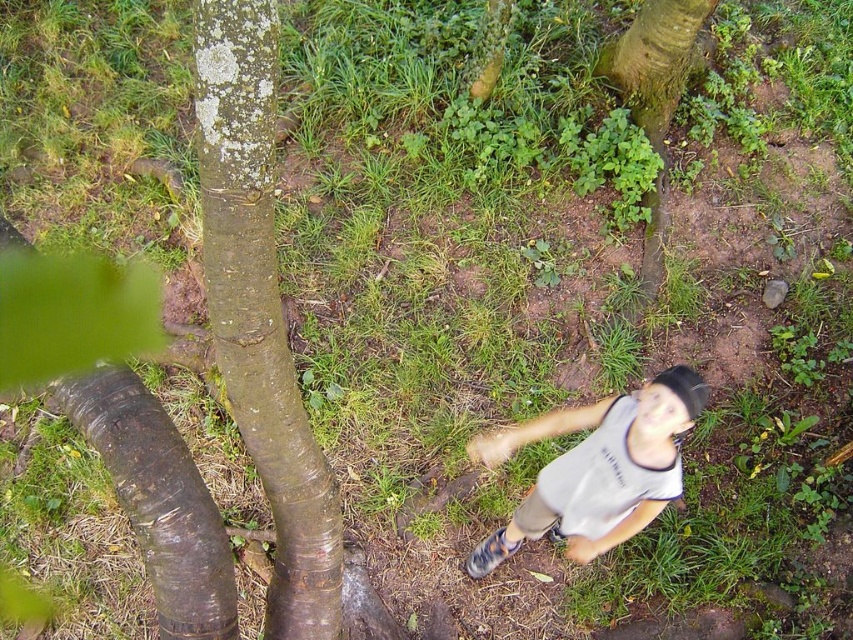
You are holding a camera and want to take a photo of the brown rough bark at left. If you are currently 1.65 meters away from it, is that a suitable distance for a closeup shot?

Yes, the brown rough bark at left is 1.65 meters away from the camera, which is a suitable distance for a closeup shot as it allows capturing details like the texture and lichen spots without being too intrusive.

You are a drone operator trying to capture a photo of the gray cotton shirt at center. The drone is currently at the point with coordinates point (596, 468). Can you confirm if the gray cotton shirt at center is directly under the drone?

The gray cotton shirt at center is located at point (596, 468), so yes, the gray cotton shirt at center is directly under the drone.

Based on the photo, you are standing in the park and see the gray cotton shirt at center and the green mossy tree trunk at upper center. Which object is located higher up in the image?

The green mossy tree trunk at upper center is located higher up in the image than the gray cotton shirt at center.